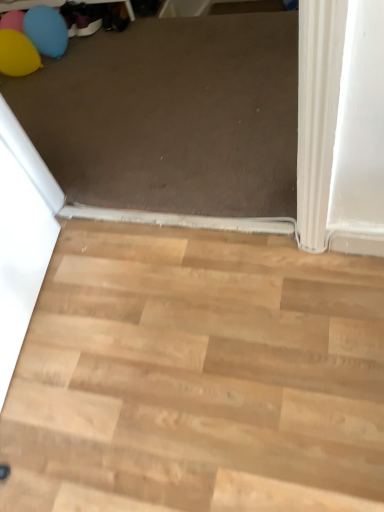
Question: Would you say rubber balloon at upper left is to the left or to the right of light wood floor at lower right in the picture?

Choices:
 (A) left
 (B) right

Answer: (A)

Question: Is rubber balloon at upper left in front of or behind light wood floor at lower right in the image?

Choices:
 (A) behind
 (B) front

Answer: (A)

Question: Does point (13, 52) appear closer or farther from the camera than point (244, 272)?

Choices:
 (A) closer
 (B) farther

Answer: (B)

Question: Is light wood floor at lower right to the left or to the right of rubber balloon at upper left in the image?

Choices:
 (A) right
 (B) left

Answer: (A)

Question: Does point (130, 376) appear closer or farther from the camera than point (31, 37)?

Choices:
 (A) farther
 (B) closer

Answer: (B)

Question: Is light wood floor at lower right taller or shorter than rubber balloon at upper left?

Choices:
 (A) tall
 (B) short

Answer: (B)

Question: From a real-world perspective, relative to rubber balloon at upper left, is light wood floor at lower right vertically above or below?

Choices:
 (A) below
 (B) above

Answer: (A)